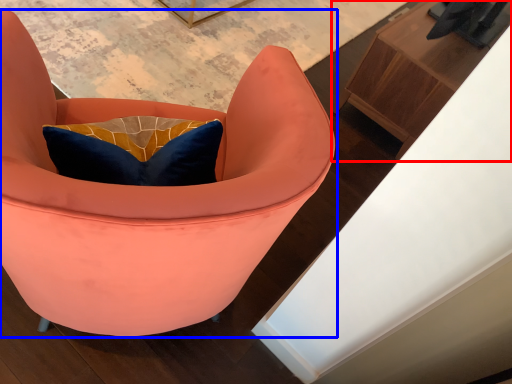
Question: Which object is further to the camera taking this photo, furniture (highlighted by a red box) or chair (highlighted by a blue box)?

Choices:
 (A) furniture
 (B) chair

Answer: (A)